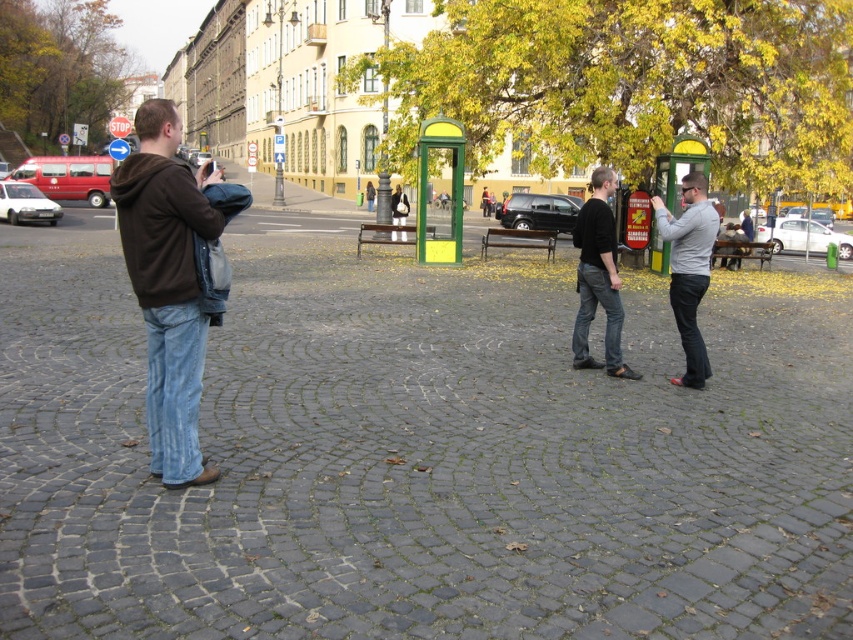
You are standing on the cobblestone pavement and want to place a small marker at point [689,269]. According to the image, where will this marker be placed?

The point [689,269] is on gray matte shirt at center, so the marker will be placed on the gray matte shirt at center.

You are a photographer aiming to capture a photo of the brown hoodie at left and the black matte shirt at center. Which person should you focus on first if you want to include both in the frame without moving the camera?

You should focus on the black matte shirt at center first because the brown hoodie at left is located above it, so starting with the lower subject ensures both will be in the frame.

In the scene shown: You are a photographer trying to capture a group photo of the brown hoodie at left and the gray matte shirt at center. Which person should you position closer to the camera to ensure both appear the same height in the photo?

Since the brown hoodie at left is much taller than the gray matte shirt at center, you should position the gray matte shirt at center closer to the camera so that both appear the same height in the photo.